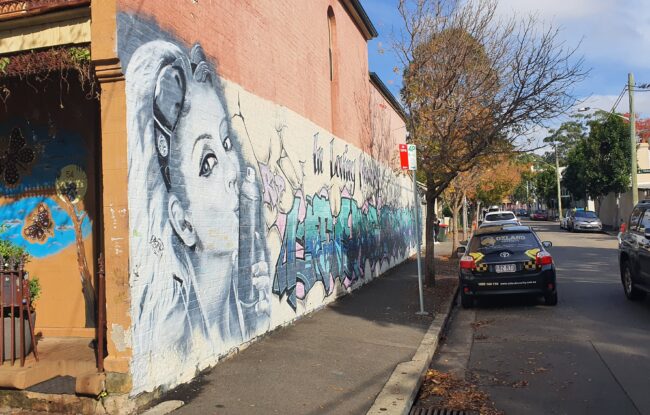
Locate an element on the screen. This screenshot has width=650, height=415. painted walls is located at coordinates (222, 278), (46, 213).